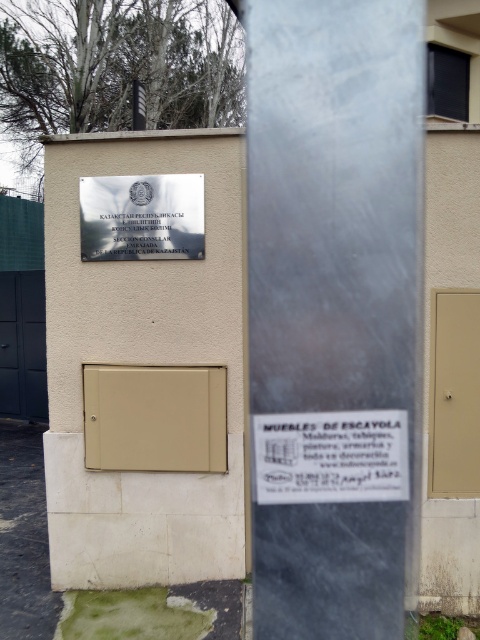
You are a delivery person who needs to deliver a package to the Consular Section. You see the beige matte door at center and the metallic silver sign at upper center. Which object is wider?

The beige matte door at center is wider than the metallic silver sign at upper center.

You are a visitor at the embassy and need to read both the white paper sign at center and the metallic silver sign at upper center. Which sign do you need to look down at from your standing position?

The white paper sign at center has a lesser height compared to the metallic silver sign at upper center, so you need to look down at the white paper sign at center.